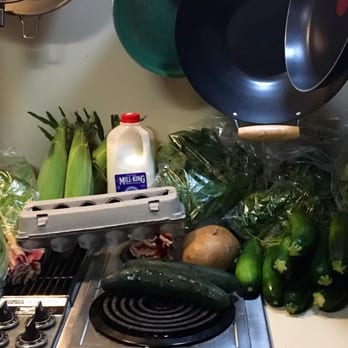
Identify the location of yellow contertop. point(311,336).